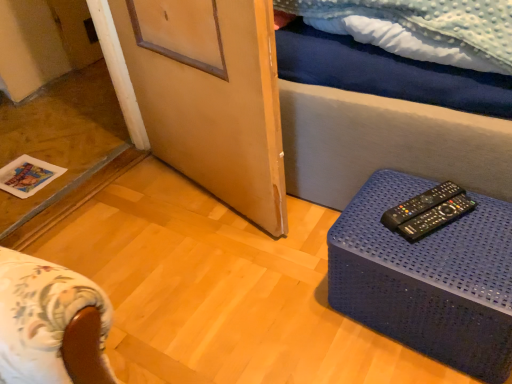
Question: Should I look upward or downward to see wooden screen door at center?

Choices:
 (A) up
 (B) down

Answer: (A)

Question: Is the surface of black plastic remote controls at right, arranged as the 2th remote control when viewed from the back, in direct contact with blue plastic table at lower right?

Choices:
 (A) yes
 (B) no

Answer: (B)

Question: Is black plastic remote controls at right, which ranks as the 1th remote control in front-to-back order, oriented towards blue plastic table at lower right?

Choices:
 (A) no
 (B) yes

Answer: (A)

Question: From a real-world perspective, is black plastic remote controls at right, arranged as the 2th remote control when viewed from the back, on top of blue plastic table at lower right?

Choices:
 (A) yes
 (B) no

Answer: (A)

Question: Considering the relative sizes of black plastic remote controls at right, arranged as the 2th remote control when viewed from the back, and blue plastic table at lower right in the image provided, is black plastic remote controls at right, arranged as the 2th remote control when viewed from the back, taller than blue plastic table at lower right?

Choices:
 (A) no
 (B) yes

Answer: (A)

Question: Is black plastic remote controls at right, which ranks as the 1th remote control in front-to-back order, to the left of blue plastic table at lower right from the viewer's perspective?

Choices:
 (A) no
 (B) yes

Answer: (B)

Question: From the image's perspective, is black plastic remote controls at right, arranged as the 2th remote control when viewed from the back, over blue plastic table at lower right?

Choices:
 (A) yes
 (B) no

Answer: (A)

Question: Is blue plastic table at lower right inside wooden screen door at center?

Choices:
 (A) no
 (B) yes

Answer: (A)

Question: Is wooden screen door at center turned away from blue plastic table at lower right?

Choices:
 (A) yes
 (B) no

Answer: (B)

Question: Is wooden screen door at center next to blue plastic table at lower right?

Choices:
 (A) yes
 (B) no

Answer: (B)

Question: Can you confirm if wooden screen door at center is shorter than blue plastic table at lower right?

Choices:
 (A) no
 (B) yes

Answer: (A)

Question: Could you tell me if wooden screen door at center is turned towards blue plastic table at lower right?

Choices:
 (A) yes
 (B) no

Answer: (B)

Question: Can you confirm if wooden screen door at center is wider than blue plastic table at lower right?

Choices:
 (A) no
 (B) yes

Answer: (A)

Question: Considering the relative sizes of black plastic remote control at right, positioned as the 1th remote control in back-to-front order, and black plastic remote controls at right, arranged as the 2th remote control when viewed from the back, in the image provided, is black plastic remote control at right, positioned as the 1th remote control in back-to-front order, bigger than black plastic remote controls at right, arranged as the 2th remote control when viewed from the back,?

Choices:
 (A) yes
 (B) no

Answer: (B)